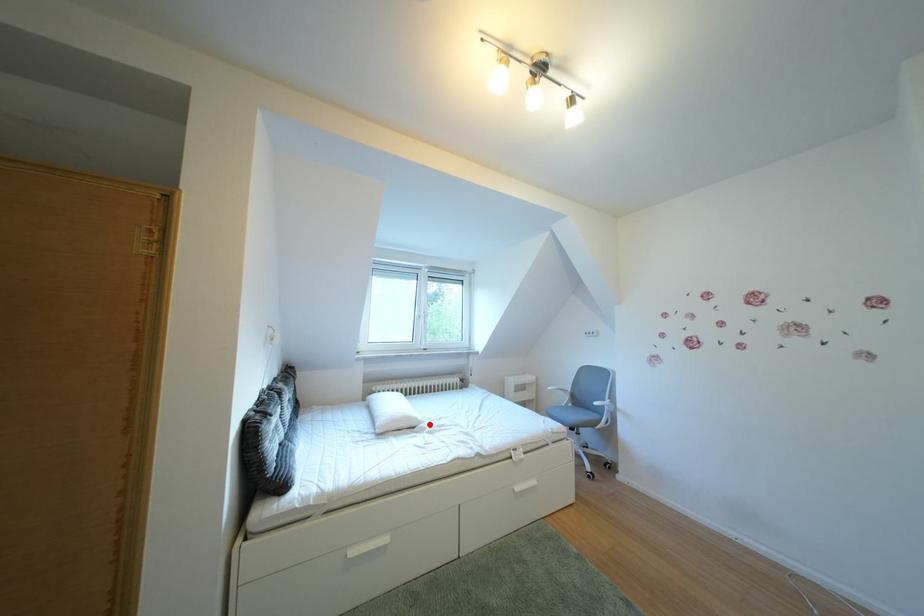
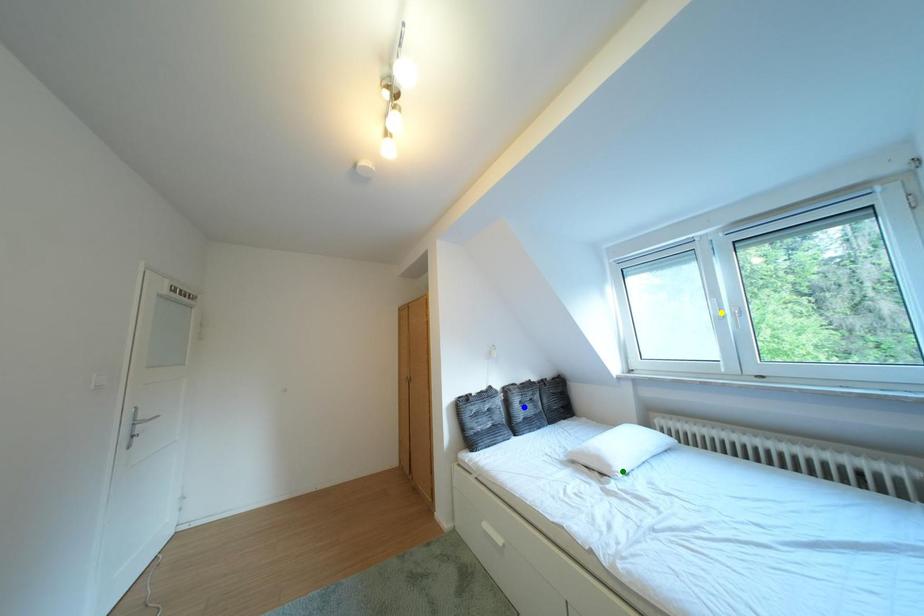
Question: I am providing you with two images of the same scene from different viewpoints. A red point is marked on the first image. You are given multiple points on the second image. Which mark in image 2 goes with the point in image 1?

Choices:
 (A) blue point
 (B) green point
 (C) yellow point

Answer: (B)